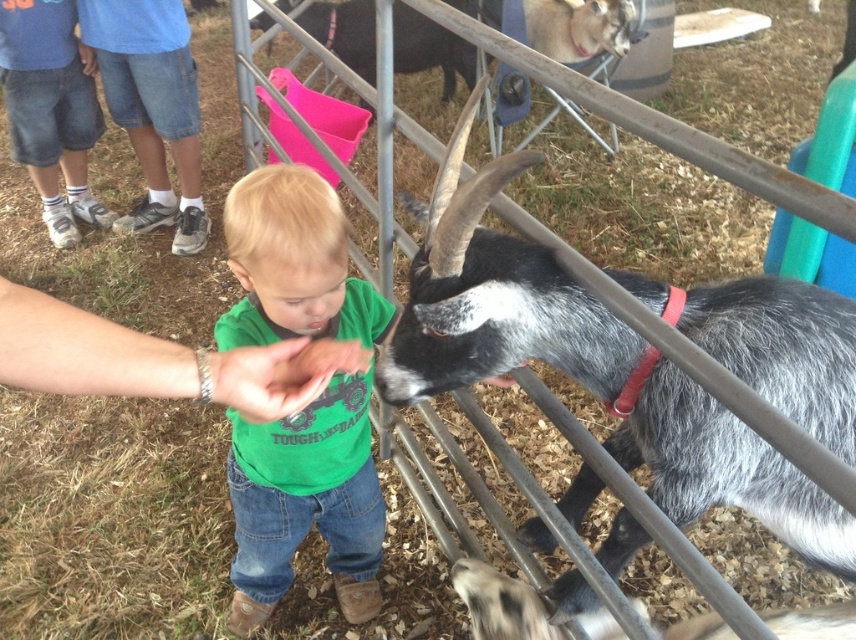
In the scene shown: Between gray speckled fur at center and green cotton shirt at center, which one appears on the left side from the viewer's perspective?

From the viewer's perspective, green cotton shirt at center appears more on the left side.

Does gray speckled fur at center appear on the left side of green cotton shirt at center?

No, gray speckled fur at center is not to the left of green cotton shirt at center.

What do you see at coordinates (584, 364) in the screenshot? I see `gray speckled fur at center` at bounding box center [584, 364].

Find the location of `gray speckled fur at center`. gray speckled fur at center is located at coordinates (584, 364).